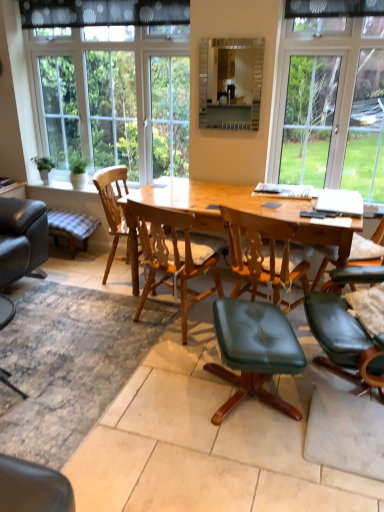
Question: Can you confirm if plaid fabric stool at lower left is bigger than black dotted fabric at upper center?

Choices:
 (A) no
 (B) yes

Answer: (B)

Question: From the image's perspective, is plaid fabric stool at lower left located above black dotted fabric at upper center?

Choices:
 (A) no
 (B) yes

Answer: (A)

Question: Considering the relative positions of plaid fabric stool at lower left and black dotted fabric at upper center in the image provided, is plaid fabric stool at lower left to the right of black dotted fabric at upper center from the viewer's perspective?

Choices:
 (A) yes
 (B) no

Answer: (B)

Question: Is black dotted fabric at upper center completely or partially inside plaid fabric stool at lower left?

Choices:
 (A) yes
 (B) no

Answer: (B)

Question: Considering the relative sizes of plaid fabric stool at lower left and black dotted fabric at upper center in the image provided, is plaid fabric stool at lower left wider than black dotted fabric at upper center?

Choices:
 (A) yes
 (B) no

Answer: (A)

Question: Considering the positions of wooden table at center and clear glass window at upper right, which is the 2th window from left to right, in the image, is wooden table at center bigger or smaller than clear glass window at upper right, which is the 2th window from left to right,?

Choices:
 (A) small
 (B) big

Answer: (B)

Question: Considering the positions of wooden table at center and clear glass window at upper right, which is the 2th window from left to right, in the image, is wooden table at center wider or thinner than clear glass window at upper right, which is the 2th window from left to right,?

Choices:
 (A) thin
 (B) wide

Answer: (B)

Question: Is wooden table at center taller or shorter than clear glass window at upper right, which is the 2th window from left to right?

Choices:
 (A) short
 (B) tall

Answer: (A)

Question: Do you think wooden table at center is within clear glass window at upper right, which ranks as the first window in right-to-left order, or outside of it?

Choices:
 (A) inside
 (B) outside

Answer: (B)

Question: Looking at their shapes, would you say matte glass mirror at upper center is wider or thinner than clear glass window at upper right, which ranks as the first window in right-to-left order?

Choices:
 (A) thin
 (B) wide

Answer: (A)

Question: Considering the positions of matte glass mirror at upper center and clear glass window at upper right, which ranks as the first window in right-to-left order, in the image, is matte glass mirror at upper center taller or shorter than clear glass window at upper right, which ranks as the first window in right-to-left order,?

Choices:
 (A) tall
 (B) short

Answer: (B)

Question: Considering the positions of matte glass mirror at upper center and clear glass window at upper right, which is the 2th window from left to right, in the image, is matte glass mirror at upper center bigger or smaller than clear glass window at upper right, which is the 2th window from left to right,?

Choices:
 (A) big
 (B) small

Answer: (B)

Question: Choose the correct answer: Is matte glass mirror at upper center inside clear glass window at upper right, which ranks as the first window in right-to-left order, or outside it?

Choices:
 (A) outside
 (B) inside

Answer: (A)

Question: Is green leather stool at center, the 1th chair when ordered from front to back, in front of or behind clear glass window at upper right, which is the 2th window from left to right, in the image?

Choices:
 (A) behind
 (B) front

Answer: (B)

Question: Is green leather stool at center, the 1th chair when ordered from front to back, taller or shorter than clear glass window at upper right, which is the 2th window from left to right?

Choices:
 (A) short
 (B) tall

Answer: (A)